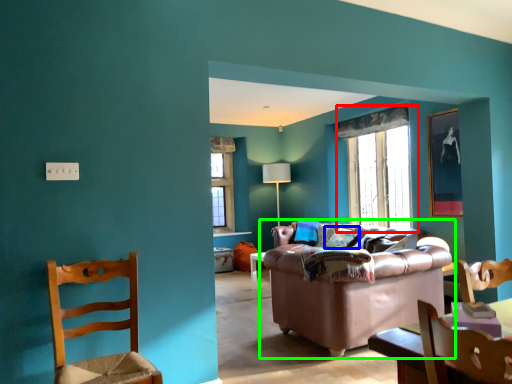
Question: Which is nearer to the window (highlighted by a red box)? pillow (highlighted by a blue box) or studio couch (highlighted by a green box).

Choices:
 (A) pillow
 (B) studio couch

Answer: (A)